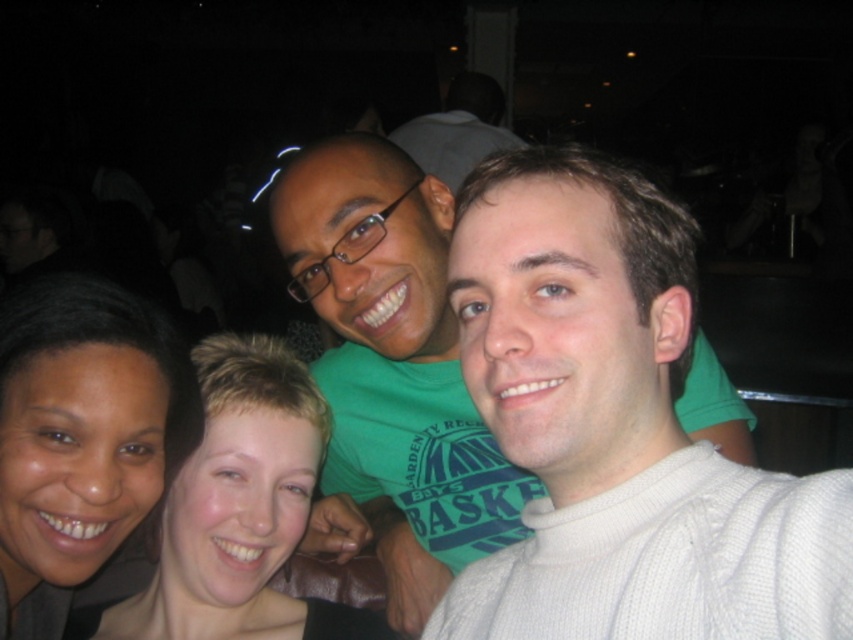
Question: Which point is farther to the camera?

Choices:
 (A) dark skin tone at lower left
 (B) smooth skin face at center

Answer: (B)

Question: Which of the following is the closest to the observer?

Choices:
 (A) (350, 196)
 (B) (281, 401)
 (C) (15, 484)

Answer: (C)

Question: Where is dark skin tone at lower left located in relation to smooth skin face at center in the image?

Choices:
 (A) right
 (B) left

Answer: (B)

Question: Which of these objects is positioned closest to the smooth skin face at center?

Choices:
 (A) green matte shirt at center
 (B) dark skin tone at lower left

Answer: (B)

Question: Can you confirm if green matte shirt at center is positioned to the left of dark skin tone at lower left?

Choices:
 (A) yes
 (B) no

Answer: (B)

Question: Is dark skin tone at lower left thinner than smooth skin face at center?

Choices:
 (A) yes
 (B) no

Answer: (A)